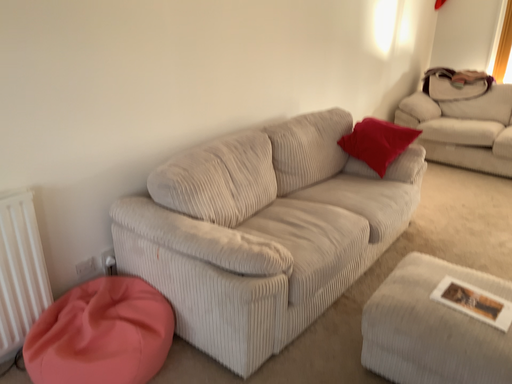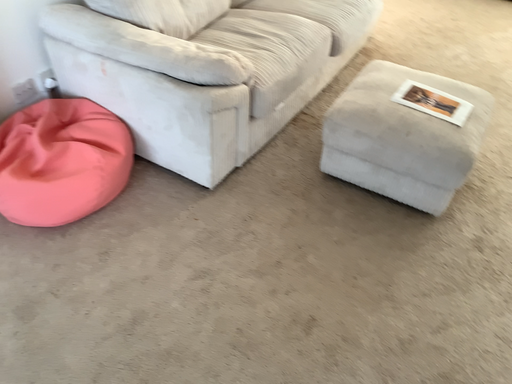
Question: Which way did the camera rotate in the video?

Choices:
 (A) rotated right
 (B) rotated left

Answer: (A)